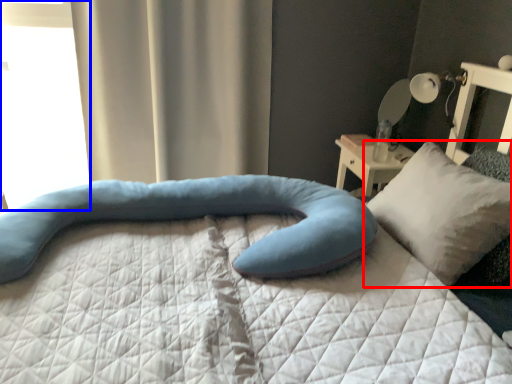
Question: Which point is further to the camera, pillow (highlighted by a red box) or window (highlighted by a blue box)?

Choices:
 (A) pillow
 (B) window

Answer: (B)